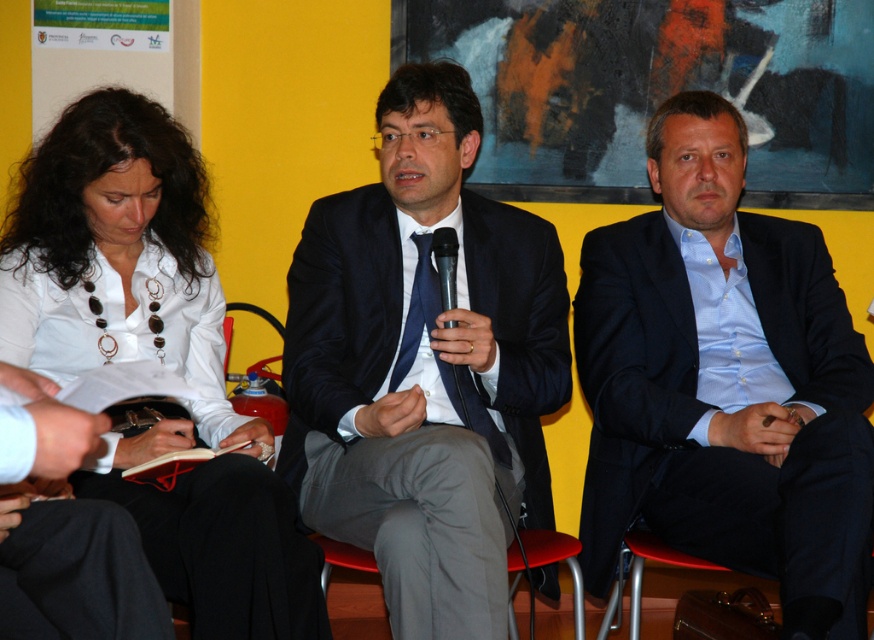
Question: Is blue satin suit at center smaller than white glossy shirt at upper left?

Choices:
 (A) yes
 (B) no

Answer: (A)

Question: Does blue satin suit at center have a larger size compared to white glossy shirt at upper left?

Choices:
 (A) yes
 (B) no

Answer: (B)

Question: Which object is positioned closest to the black plastic microphone at center?

Choices:
 (A) blue satin suit at center
 (B) white glossy shirt at upper left
 (C) matte black suit at center

Answer: (C)

Question: Is matte black suit at center further to camera compared to white glossy shirt at upper left?

Choices:
 (A) no
 (B) yes

Answer: (A)

Question: Which point is closer to the camera?

Choices:
 (A) (385, 243)
 (B) (133, 115)
 (C) (741, 534)
 (D) (449, 323)

Answer: (D)

Question: Which point is farther to the camera?

Choices:
 (A) (709, 536)
 (B) (510, 362)
 (C) (148, 448)
 (D) (453, 230)

Answer: (B)